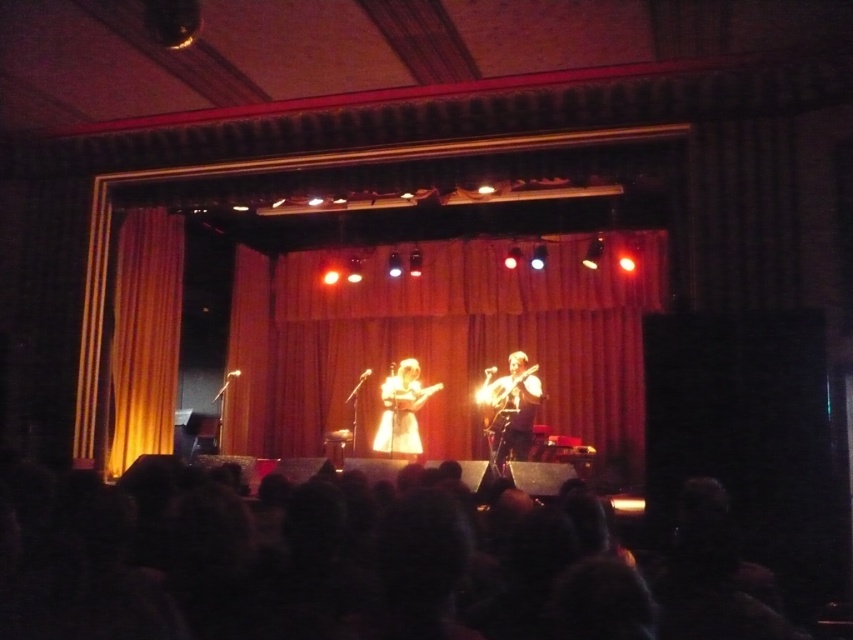
You are an audience member sitting in the front row of the theater. You notice two performers on stage. One has black hair at lower center and the other is wearing a white fabric dress at center. Which performer is closer to you?

The black hair at lower center is in front of the white fabric dress at center, so the performer with black hair at lower center is closer to you.

You are a stagehand who needs to ensure that the orange velvet curtain at left and the shiny black guitar at center are visible to the audience. Since the curtain is narrower than the guitar, which object should you adjust the spotlight on to make sure both are properly illuminated?

Since the orange velvet curtain at left is narrower than the shiny black guitar at center, you should adjust the spotlight on the orange velvet curtain at left to ensure it receives adequate illumination while the guitar may already be within the spotlight range due to its larger width.

You are sitting in the audience and notice a performer on stage. Where exactly is the black hair at lower center located in relation to the other objects on stage?

The black hair at lower center is located at point 0.884 on the x axis and 0.392 on the y axis.